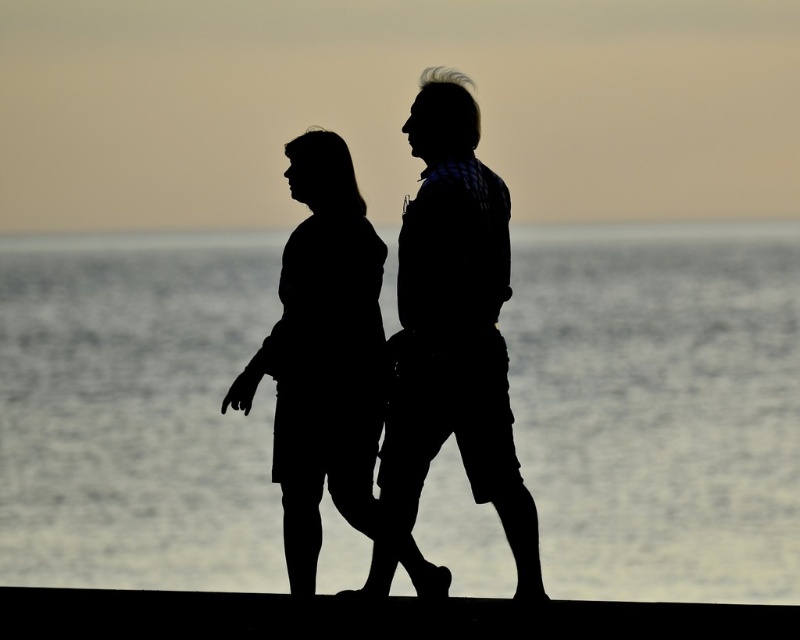
Question: Does transparent water at center lie behind black matte figure at center?

Choices:
 (A) no
 (B) yes

Answer: (B)

Question: Which is nearer to the black matte figure at center?

Choices:
 (A) silhouette shirt at center
 (B) transparent water at center

Answer: (A)

Question: Which of the following is the closest to the observer?

Choices:
 (A) silhouette shirt at center
 (B) black matte figure at center
 (C) transparent water at center

Answer: (B)

Question: Which point is closer to the camera?

Choices:
 (A) (645, 433)
 (B) (354, 308)
 (C) (445, 88)

Answer: (B)

Question: Does silhouette shirt at center have a lesser width compared to black matte figure at center?

Choices:
 (A) no
 (B) yes

Answer: (B)

Question: Can you confirm if transparent water at center is smaller than silhouette shirt at center?

Choices:
 (A) no
 (B) yes

Answer: (A)